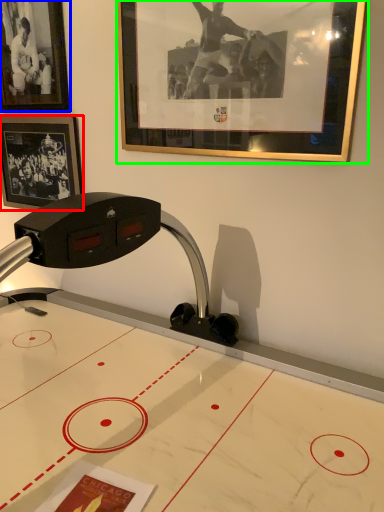
Question: Considering the real-world distances, which object is farthest from picture frame (highlighted by a red box)? picture frame (highlighted by a blue box) or picture frame (highlighted by a green box)?

Choices:
 (A) picture frame
 (B) picture frame

Answer: (B)